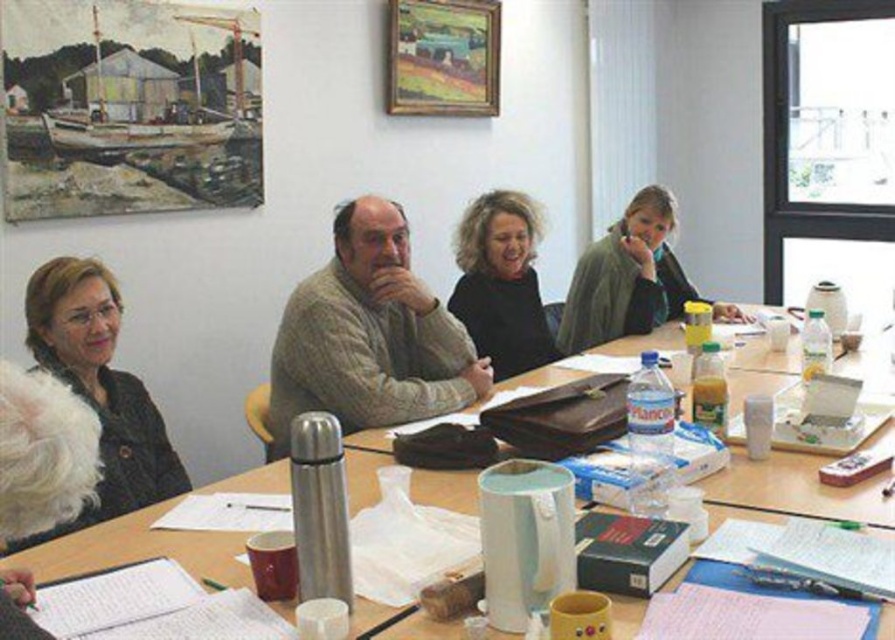
Is white paper at upper left to the left of black sweater at center from the viewer's perspective?

Yes, white paper at upper left is to the left of black sweater at center.

Is point (638, 612) less distant than point (492, 268)?

That is True.

This screenshot has height=640, width=895. What are the coordinates of `white paper at upper left` in the screenshot? It's located at (791, 492).

Between point (273, 472) and point (108, 289), which one is positioned behind?

Point (108, 289)

Is point (780, 461) positioned before point (128, 496)?

Yes.

Is point (198, 531) in front of point (90, 372)?

That is True.

Locate an element on the screen. The image size is (895, 640). white paper at upper left is located at coordinates (791, 492).

Is black fuzzy jacket at lower left positioned at the back of black sweater at center?

No, black fuzzy jacket at lower left is closer to the viewer.

This screenshot has width=895, height=640. I want to click on black fuzzy jacket at lower left, so click(x=99, y=388).